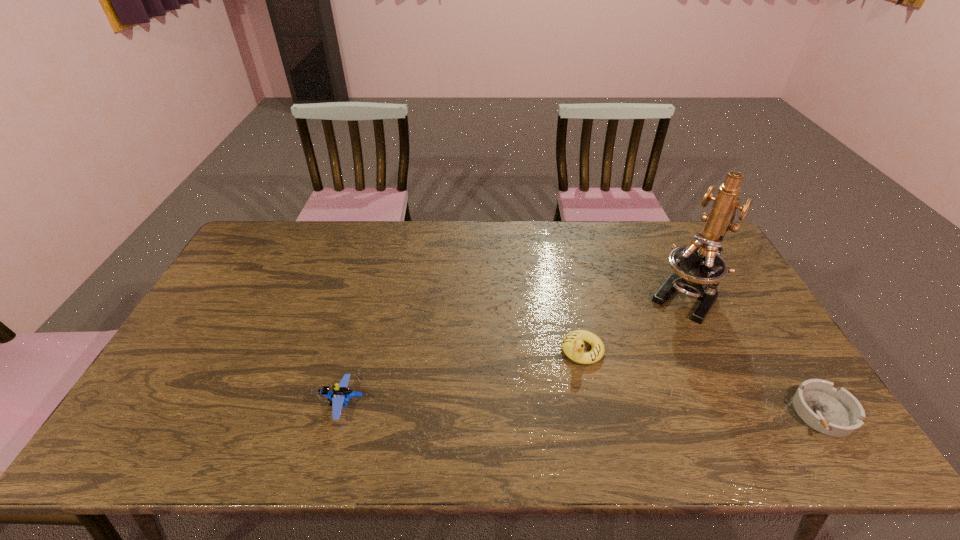
Locate an element on the screen. The width and height of the screenshot is (960, 540). free space located 0.250m on the left of the ashtray is located at coordinates (693, 412).

Locate an element on the screen. Image resolution: width=960 pixels, height=540 pixels. free point located 0.300m at the eyepiece of the tallest object is located at coordinates (626, 382).

This screenshot has height=540, width=960. I want to click on vacant region located 0.300m at the eyepiece of the tallest object, so click(626, 382).

Locate an element on the screen. This screenshot has height=540, width=960. vacant space located 0.120m at the eyepiece of the tallest object is located at coordinates (655, 341).

At what (x,y) coordinates should I click in order to perform the action: click on free space located 0.190m on the face of the duckling. Please return your answer as a coordinate pair (x, y). Looking at the image, I should click on (533, 413).

The width and height of the screenshot is (960, 540). I want to click on vacant space located on the face of the duckling, so pyautogui.click(x=536, y=410).

In order to click on vacant space located on the face of the duckling in this screenshot , I will do `click(555, 386)`.

The image size is (960, 540). I want to click on Lego that is at the near edge, so click(x=338, y=398).

Identify the location of ashtray that is at the near edge. (837, 413).

This screenshot has height=540, width=960. Find the location of `ashtray situated at the right edge`. ashtray situated at the right edge is located at coordinates (837, 413).